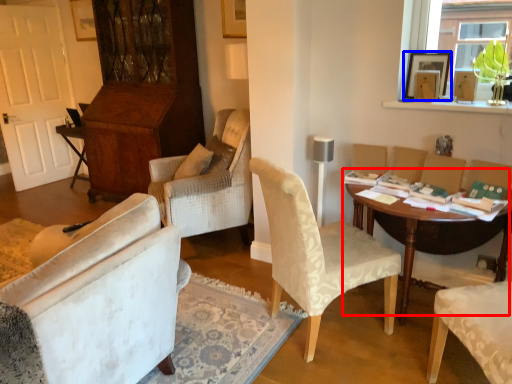
Question: Which of the following is the closest to the observer, table (highlighted by a red box) or picture frame (highlighted by a blue box)?

Choices:
 (A) table
 (B) picture frame

Answer: (A)